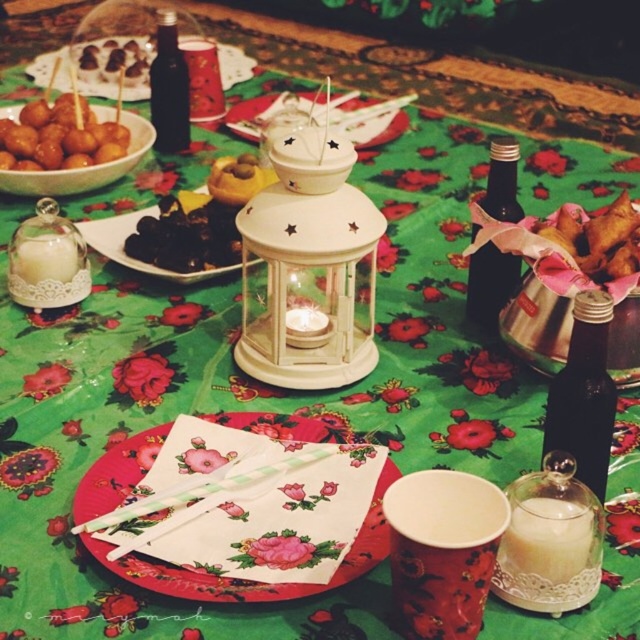
Question: Which object appears farthest from the camera in this image?

Choices:
 (A) black glossy grapes at center
 (B) golden crispy samosa at center right
 (C) black glass bottle at center

Answer: (C)

Question: Is the position of black glass bottle at center-right less distant than that of yellow matte pastry at center?

Choices:
 (A) yes
 (B) no

Answer: (A)

Question: Based on their relative distances, which object is nearer to the dark glass bottle at right?

Choices:
 (A) matte brown balls at left
 (B) matte brown plate at upper left

Answer: (A)

Question: Does black glossy grapes at center lie behind yellow matte pastry at center?

Choices:
 (A) yes
 (B) no

Answer: (B)

Question: Is white paper napkin at center to the right of black glass bottle at center-right from the viewer's perspective?

Choices:
 (A) no
 (B) yes

Answer: (A)

Question: Which object is positioned closest to the matte brown plate at upper left?

Choices:
 (A) dark glass bottle at right
 (B) golden crispy samosa at center right

Answer: (A)